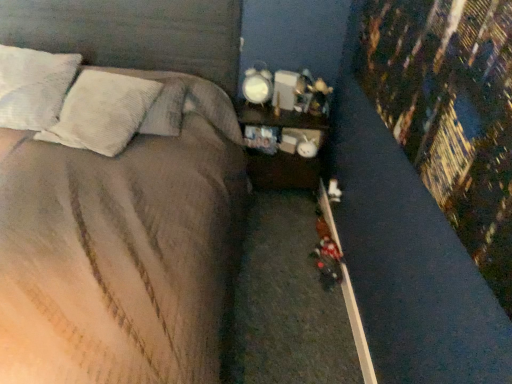
Question: Considering the relative positions of white textured pillow at upper left, the 3th pillow viewed from the left, and wooden nightstand at center in the image provided, is white textured pillow at upper left, the 3th pillow viewed from the left, in front of wooden nightstand at center?

Choices:
 (A) yes
 (B) no

Answer: (A)

Question: From the image's perspective, does white textured pillow at upper left, which ranks as the first pillow in right-to-left order, appear higher than wooden nightstand at center?

Choices:
 (A) no
 (B) yes

Answer: (B)

Question: Does white textured pillow at upper left, which ranks as the first pillow in right-to-left order, turn towards wooden nightstand at center?

Choices:
 (A) yes
 (B) no

Answer: (B)

Question: Is white textured pillow at upper left, which ranks as the first pillow in right-to-left order, placed right next to wooden nightstand at center?

Choices:
 (A) no
 (B) yes

Answer: (A)

Question: Considering the relative positions of white textured pillow at upper left, which ranks as the first pillow in right-to-left order, and wooden nightstand at center in the image provided, is white textured pillow at upper left, which ranks as the first pillow in right-to-left order, to the left of wooden nightstand at center from the viewer's perspective?

Choices:
 (A) yes
 (B) no

Answer: (A)

Question: Does white textured pillow at upper left, the 3th pillow viewed from the left, have a lesser width compared to wooden nightstand at center?

Choices:
 (A) no
 (B) yes

Answer: (A)

Question: Could you tell me if wooden nightstand at center is turned towards satin brown bed at center?

Choices:
 (A) no
 (B) yes

Answer: (A)

Question: Does wooden nightstand at center have a greater width compared to satin brown bed at center?

Choices:
 (A) no
 (B) yes

Answer: (A)

Question: From a real-world perspective, is wooden nightstand at center on top of satin brown bed at center?

Choices:
 (A) yes
 (B) no

Answer: (B)

Question: Is wooden nightstand at center looking in the opposite direction of satin brown bed at center?

Choices:
 (A) yes
 (B) no

Answer: (B)

Question: From the image's perspective, is wooden nightstand at center below satin brown bed at center?

Choices:
 (A) yes
 (B) no

Answer: (B)

Question: Does wooden nightstand at center have a smaller size compared to satin brown bed at center?

Choices:
 (A) no
 (B) yes

Answer: (B)

Question: Is white textured pillow at upper left, the second pillow in the right-to-left sequence, oriented towards satin brown bed at center?

Choices:
 (A) no
 (B) yes

Answer: (B)